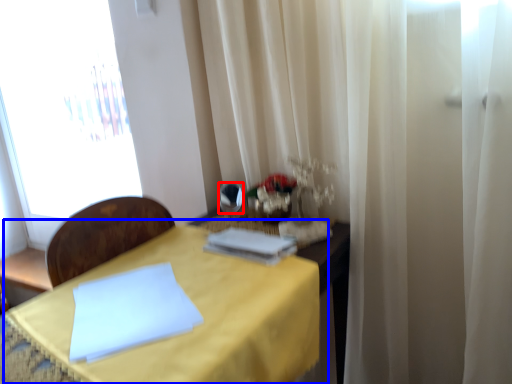
Question: Which object is closer to the camera taking this photo, mirror (highlighted by a red box) or table (highlighted by a blue box)?

Choices:
 (A) mirror
 (B) table

Answer: (B)